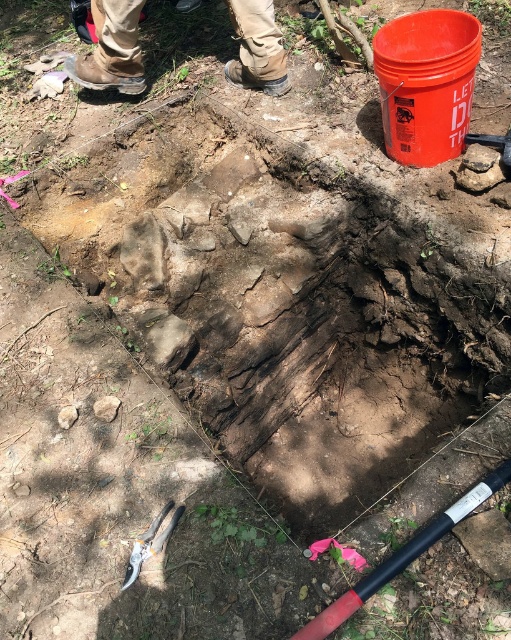
Question: Which of the following is the closest to the observer?

Choices:
 (A) brown leather boots at upper left
 (B) black rubber pole at lower center
 (C) metallic silver pliers at lower left

Answer: (B)

Question: Which object is positioned farthest from the metallic silver pliers at lower left?

Choices:
 (A) brown leather boots at upper left
 (B) black rubber pole at lower center

Answer: (A)

Question: Does brown leather boots at upper left appear on the left side of metallic silver pliers at lower left?

Choices:
 (A) no
 (B) yes

Answer: (B)

Question: Which point is farther to the camera?

Choices:
 (A) pos(160,536)
 (B) pos(506,472)
 (C) pos(258,33)

Answer: (C)

Question: Can you confirm if brown leather boots at upper left is positioned to the left of metallic silver pliers at lower left?

Choices:
 (A) no
 (B) yes

Answer: (B)

Question: Is brown leather boots at upper left further to the viewer compared to black rubber pole at lower center?

Choices:
 (A) yes
 (B) no

Answer: (A)